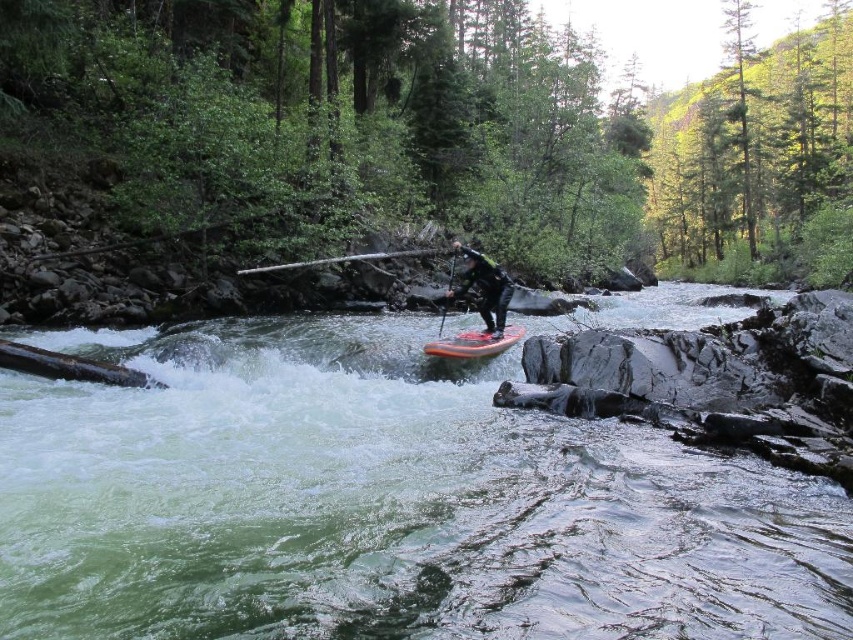
You are a photographer positioned on the riverbank observing the black rubber wetsuit at center and the orange glossy canoe at center. Which object is closer to your camera lens?

The black rubber wetsuit at center is closer to your camera lens because it is further to the viewer than the orange glossy canoe at center.

You are a safety inspector assessing the equipment of the paddleboarder. The black rubber wetsuit at center and the smooth wooden paddle at center are both critical for safety. Which of these two items is more likely to be insufficient in terms of buoyancy if they are both submerged in water?

The black rubber wetsuit at center is more likely to be insufficient in terms of buoyancy because it is thinner than the smooth wooden paddle at center, which would provide better buoyancy due to its larger volume and material.